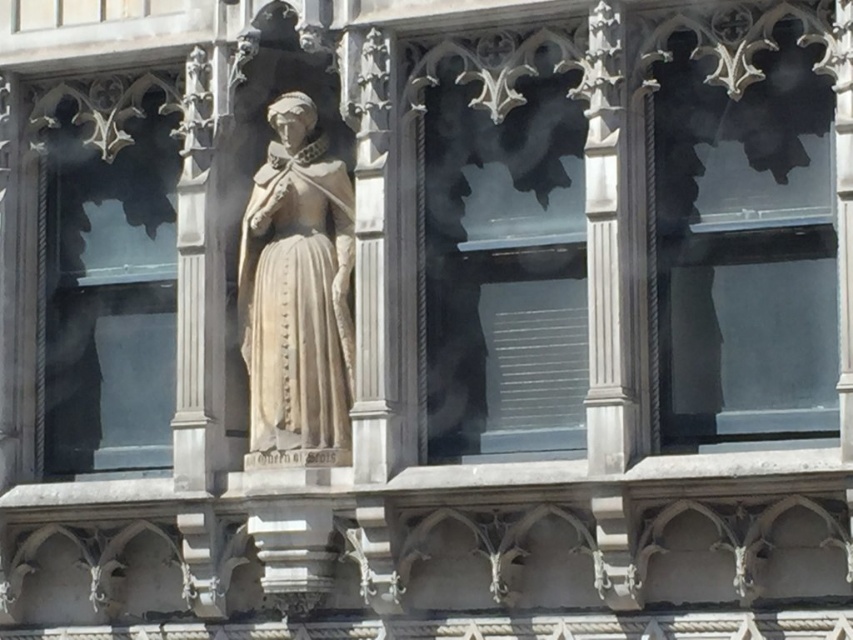
Which is in front, point (102, 307) or point (283, 97)?

Point (283, 97)

Who is shorter, transparent glass window at left or white stone statue at center?

white stone statue at center

Does point (73, 353) lie behind point (270, 266)?

Yes.

The width and height of the screenshot is (853, 640). Find the location of `transparent glass window at left`. transparent glass window at left is located at coordinates (106, 284).

Which is in front, point (734, 435) or point (541, 76)?

Point (734, 435)

Which is below, transparent glass window at upper center or clear glass window at center?

clear glass window at center is below.

Which is in front, point (755, 172) or point (563, 278)?

Point (755, 172)

Locate an element on the screen. transparent glass window at upper center is located at coordinates (x=744, y=248).

Does clear glass window at center appear over transparent glass window at left?

Indeed, clear glass window at center is positioned over transparent glass window at left.

Is clear glass window at center positioned at the back of transparent glass window at left?

No, it is in front of transparent glass window at left.

Locate an element on the screen. The image size is (853, 640). clear glass window at center is located at coordinates (503, 268).

The height and width of the screenshot is (640, 853). I want to click on clear glass window at center, so click(x=503, y=268).